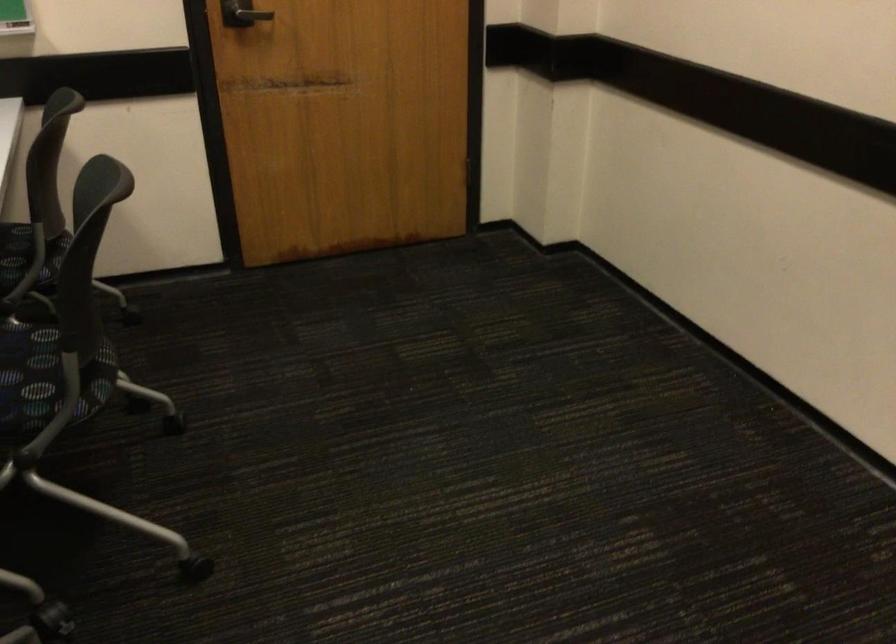
What do you see at coordinates (47, 374) in the screenshot?
I see `the chair sitting surface` at bounding box center [47, 374].